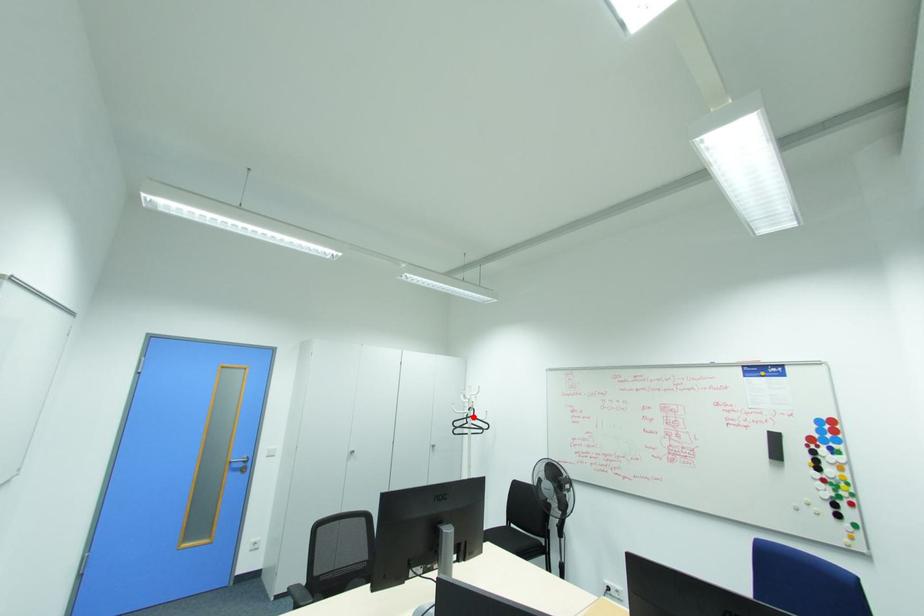
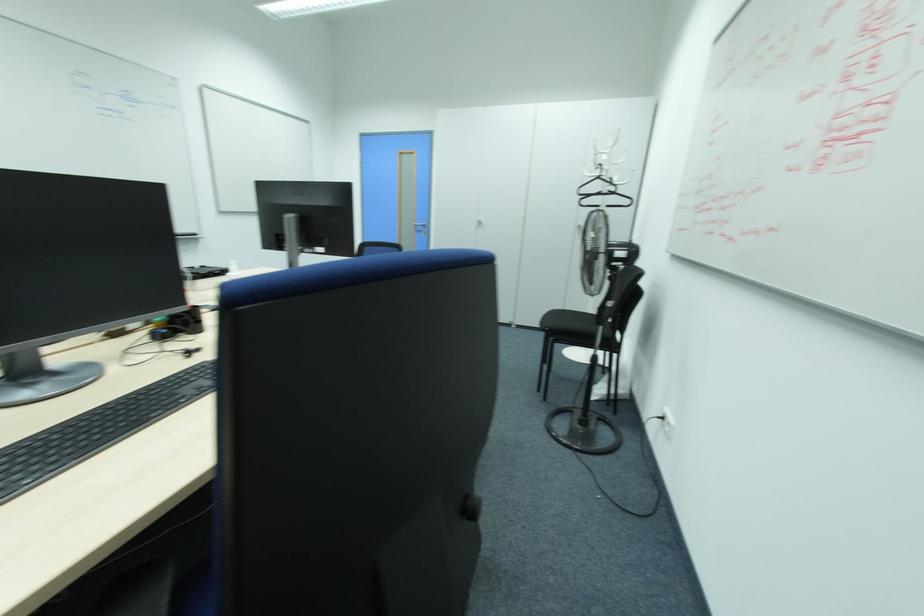
Question: I am providing you with two images of the same scene from different viewpoints. Image1 has a red point marked. In image2, the corresponding 3D location appears at what relative position? Reply with the corresponding letter.

Choices:
 (A) Closer
 (B) Farther

Answer: (A)